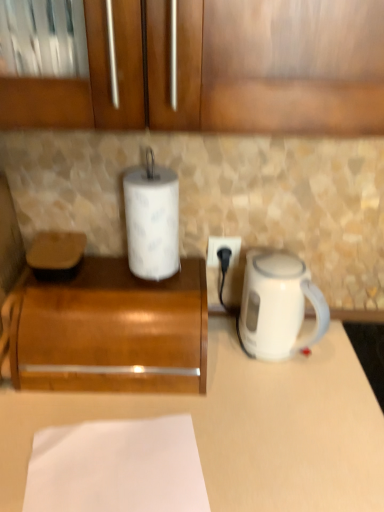
This screenshot has height=512, width=384. What do you see at coordinates (221, 248) in the screenshot?
I see `white plastic power outlet at center` at bounding box center [221, 248].

What do you see at coordinates (117, 467) in the screenshot?
I see `white paper at lower center` at bounding box center [117, 467].

Where is `white plastic power outlet at center`? Image resolution: width=384 pixels, height=512 pixels. white plastic power outlet at center is located at coordinates (221, 248).

Who is shorter, white matte counter at center or white paper at center?

With less height is white paper at center.

How many degrees apart are the facing directions of white matte counter at center and white paper at center?

0.762 degrees.

Is white matte counter at center facing towards white paper at center?

No.

In the scene shown: Is the position of white matte counter at center less distant than that of white paper at center?

Yes, the depth of white matte counter at center is less than that of white paper at center.

Does white paper at center lie in front of wooden at left?

Yes, white paper at center is closer to the camera.

Is white paper at center facing towards wooden at left?

No, white paper at center is not oriented towards wooden at left.

At what (x,y) coordinates should I click in order to perform the action: click on paper towel located above the wooden at left (from a real-world perspective). Please return your answer as a coordinate pair (x, y). The width and height of the screenshot is (384, 512). Looking at the image, I should click on (152, 222).

From the image's perspective, is white paper at center under wooden at left?

No, from the image's perspective, white paper at center is not beneath wooden at left.

From the image's perspective, is wooden at left above or below white matte counter at center?

Clearly, from the image's perspective, wooden at left is above white matte counter at center.

Is the position of wooden at left less distant than that of white matte counter at center?

No, it is behind white matte counter at center.

Is wooden at left beside white matte counter at center?

They are not placed beside each other.

Which object is positioned more to the left, white plastic power outlet at center or white matte counter at center?

white plastic power outlet at center is more to the left.

Choose the correct answer: Is white plastic power outlet at center inside white matte counter at center or outside it?

The correct answer is: outside.

Find the location of `counter below the white plastic power outlet at center (from a real-world perspective)`. counter below the white plastic power outlet at center (from a real-world perspective) is located at coordinates (241, 426).

Is white plastic power outlet at center oriented away from white matte counter at center?

white plastic power outlet at center is not turned away from white matte counter at center.

Does white paper at lower center have a smaller size compared to white matte counter at center?

Indeed, white paper at lower center has a smaller size compared to white matte counter at center.

Is white paper at lower center facing away from white matte counter at center?

No, white paper at lower center is not facing the opposite direction of white matte counter at center.

How many degrees apart are the facing directions of white paper at lower center and white matte counter at center?

9.18 degrees.

From the image's perspective, which one is positioned higher, white paper at lower center or white matte counter at center?

white paper at lower center.

Does point (250, 399) come behind point (51, 500)?

That is True.

Who is more distant, white matte counter at center or white paper at lower center?

white matte counter at center is behind.

Is white matte counter at center smaller than white paper at lower center?

No.

Which is correct: white paper at center is inside white paper at lower center, or outside of it?

white paper at center is not enclosed by white paper at lower center.

The width and height of the screenshot is (384, 512). I want to click on paper towel behind the white paper at lower center, so click(x=152, y=222).

Does white paper at center touch white paper at lower center?

They are not placed beside each other.

Is white paper at center turned away from white paper at lower center?

That's not correct — white paper at center is not looking away from white paper at lower center.

At what (x,y) coordinates should I click in order to perform the action: click on counter in front of the white paper at center. Please return your answer as a coordinate pair (x, y). The image size is (384, 512). Looking at the image, I should click on (241, 426).

Image resolution: width=384 pixels, height=512 pixels. I want to click on cabinetry that appears behind the white paper at center, so click(x=112, y=331).

Based on their spatial positions, is white paper at center or white matte counter at center closer to white glossy electric kettle at right?

The object closer to white glossy electric kettle at right is white matte counter at center.

Estimate the real-world distances between objects in this image. Which object is closer to white plastic power outlet at center, white matte counter at center or white paper at lower center?

white matte counter at center.

Based on their spatial positions, is wooden at left or white paper at center closer to white glossy electric kettle at right?

white paper at center lies closer to white glossy electric kettle at right than the other object.

From the image, which object appears to be nearer to white matte counter at center, white glossy electric kettle at right or wooden at left?

Among the two, wooden at left is located nearer to white matte counter at center.

Based on their spatial positions, is white glossy electric kettle at right or wooden at left closer to white paper at center?

wooden at left lies closer to white paper at center than the other object.

From the image, which object appears to be farther from white plastic power outlet at center, white paper at lower center or white paper at center?

white paper at lower center.

Estimate the real-world distances between objects in this image. Which object is closer to white plastic power outlet at center, white paper at center or wooden at left?

white paper at center is positioned closer to the anchor white plastic power outlet at center.

Based on their spatial positions, is white paper at center or wooden at left further from white glossy electric kettle at right?

wooden at left lies further to white glossy electric kettle at right than the other object.

Where is `cabinetry between white paper at center and white matte counter at center in the up-down direction`? cabinetry between white paper at center and white matte counter at center in the up-down direction is located at coordinates (112, 331).

Identify the location of coffee cup between white paper at center and white matte counter at center in the up-down direction. The height and width of the screenshot is (512, 384). (278, 305).

Where is `cabinetry between white paper at center and white paper at lower center from top to bottom`? cabinetry between white paper at center and white paper at lower center from top to bottom is located at coordinates (112, 331).

Where is `coffee cup between white plastic power outlet at center and white matte counter at center in the vertical direction`? The width and height of the screenshot is (384, 512). coffee cup between white plastic power outlet at center and white matte counter at center in the vertical direction is located at coordinates (278, 305).